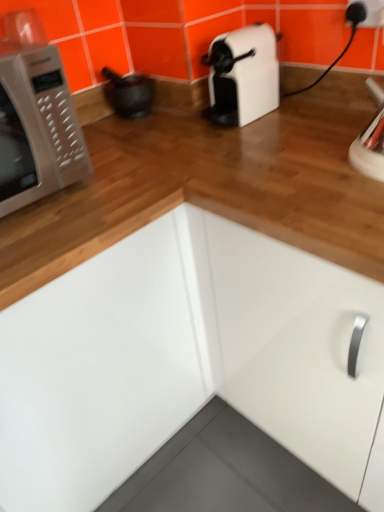
Question: Is white glossy microwave oven at left facing towards white glossy cabinet at center?

Choices:
 (A) no
 (B) yes

Answer: (A)

Question: Is white glossy microwave oven at left wider than white glossy cabinet at center?

Choices:
 (A) yes
 (B) no

Answer: (B)

Question: Is white glossy microwave oven at left thinner than white glossy cabinet at center?

Choices:
 (A) no
 (B) yes

Answer: (B)

Question: Is white glossy microwave oven at left positioned beyond the bounds of white glossy cabinet at center?

Choices:
 (A) yes
 (B) no

Answer: (A)

Question: From the image's perspective, is white glossy microwave oven at left above white glossy cabinet at center?

Choices:
 (A) yes
 (B) no

Answer: (A)

Question: Considering the positions of point (148, 98) and point (170, 259), is point (148, 98) closer or farther from the camera than point (170, 259)?

Choices:
 (A) farther
 (B) closer

Answer: (A)

Question: Is matte black mortar at upper left in front of or behind white glossy cabinet at center in the image?

Choices:
 (A) front
 (B) behind

Answer: (B)

Question: In terms of width, does matte black mortar at upper left look wider or thinner when compared to white glossy cabinet at center?

Choices:
 (A) thin
 (B) wide

Answer: (A)

Question: From the image's perspective, is matte black mortar at upper left located above or below white glossy cabinet at center?

Choices:
 (A) above
 (B) below

Answer: (A)

Question: Based on their positions, is matte black mortar at upper left located to the left or right of white glossy microwave oven at left?

Choices:
 (A) left
 (B) right

Answer: (B)

Question: From a real-world perspective, is matte black mortar at upper left positioned above or below white glossy microwave oven at left?

Choices:
 (A) above
 (B) below

Answer: (B)

Question: In terms of size, does matte black mortar at upper left appear bigger or smaller than white glossy microwave oven at left?

Choices:
 (A) big
 (B) small

Answer: (B)

Question: In terms of width, does matte black mortar at upper left look wider or thinner when compared to white glossy microwave oven at left?

Choices:
 (A) wide
 (B) thin

Answer: (B)

Question: In terms of height, does matte black mortar at upper left look taller or shorter compared to white plastic electric outlet at upper right?

Choices:
 (A) short
 (B) tall

Answer: (B)

Question: Which is correct: matte black mortar at upper left is inside white plastic electric outlet at upper right, or outside of it?

Choices:
 (A) inside
 (B) outside

Answer: (B)